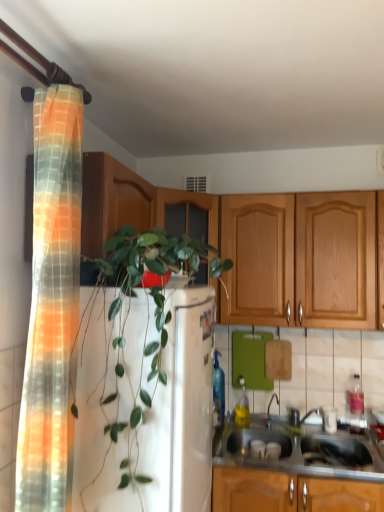
Question: Considering the relative positions of green leafy plant at center and stainless steel sink at lower right in the image provided, is green leafy plant at center in front of stainless steel sink at lower right?

Choices:
 (A) no
 (B) yes

Answer: (B)

Question: Is green leafy plant at center at the left side of stainless steel sink at lower right?

Choices:
 (A) yes
 (B) no

Answer: (A)

Question: Could you tell me if green leafy plant at center is facing stainless steel sink at lower right?

Choices:
 (A) yes
 (B) no

Answer: (B)

Question: Is green leafy plant at center shorter than stainless steel sink at lower right?

Choices:
 (A) no
 (B) yes

Answer: (A)

Question: Would you say stainless steel sink at lower right is part of green leafy plant at center's contents?

Choices:
 (A) yes
 (B) no

Answer: (B)

Question: From the image's perspective, is green leafy plant at center below stainless steel sink at lower right?

Choices:
 (A) yes
 (B) no

Answer: (B)

Question: Is wooden cabinet at upper left to the left of translucent orange-yellow fabric at left from the viewer's perspective?

Choices:
 (A) no
 (B) yes

Answer: (A)

Question: From a real-world perspective, does wooden cabinet at upper left stand above translucent orange-yellow fabric at left?

Choices:
 (A) yes
 (B) no

Answer: (A)

Question: Is wooden cabinet at upper left facing away from translucent orange-yellow fabric at left?

Choices:
 (A) no
 (B) yes

Answer: (A)

Question: Is wooden cabinet at upper left wider than translucent orange-yellow fabric at left?

Choices:
 (A) no
 (B) yes

Answer: (B)

Question: Is wooden cabinet at upper left to the right of translucent orange-yellow fabric at left from the viewer's perspective?

Choices:
 (A) no
 (B) yes

Answer: (B)

Question: Is the surface of wooden cabinet at upper left in direct contact with translucent orange-yellow fabric at left?

Choices:
 (A) yes
 (B) no

Answer: (B)

Question: From a real-world perspective, is green leafy plant at center physically above metallic silver faucet at sink right?

Choices:
 (A) yes
 (B) no

Answer: (A)